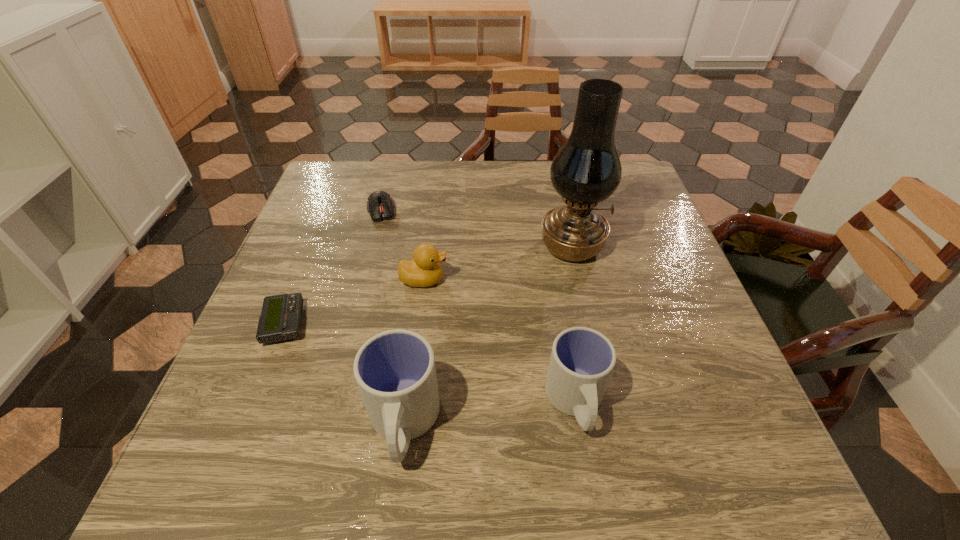
At what (x,y) coordinates should I click in order to perform the action: click on vacant space positioned 0.110m on the right of the second shortest object. Please return your answer as a coordinate pair (x, y). This screenshot has width=960, height=540. Looking at the image, I should click on (437, 211).

The image size is (960, 540). I want to click on free region located 0.160m on the right of the fourth farthest object, so click(385, 323).

Locate an element on the screen. The image size is (960, 540). vacant space situated on the left of the oil lamp is located at coordinates (434, 246).

Identify the location of free space located on the face of the fourth tallest object. [527, 279].

The width and height of the screenshot is (960, 540). I want to click on object located at the far edge, so click(x=380, y=205).

Where is `object at the left edge`? This screenshot has height=540, width=960. object at the left edge is located at coordinates (281, 316).

You are a GUI agent. You are given a task and a screenshot of the screen. Output one action in this format:
    pyautogui.click(x=<x>, y=<y>)
    Task: Click on the vacant area at the far edge
    
    Given the screenshot: What is the action you would take?
    pyautogui.click(x=504, y=166)

Identify the location of free space at the near edge of the desktop. (533, 387).

Locate an element on the screen. vacant space at the left edge is located at coordinates (321, 290).

Locate an element on the screen. The height and width of the screenshot is (540, 960). vacant space at the right edge is located at coordinates (659, 258).